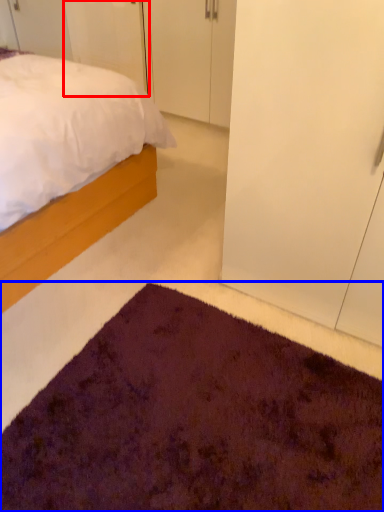
Question: Which of the following is the closest to the observer, door (highlighted by a red box) or doormat (highlighted by a blue box)?

Choices:
 (A) door
 (B) doormat

Answer: (B)